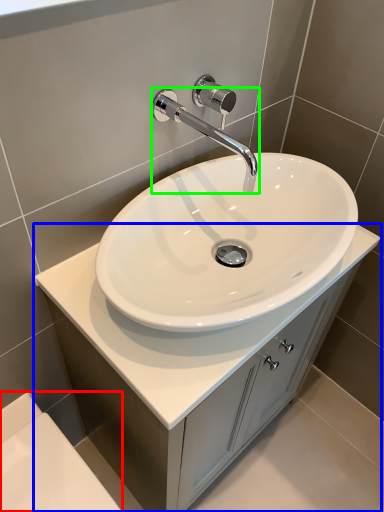
Question: Based on their relative distances, which object is farther from bath (highlighted by a red box)? Choose from bathroom cabinet (highlighted by a blue box) and tap (highlighted by a green box).

Choices:
 (A) bathroom cabinet
 (B) tap

Answer: (B)